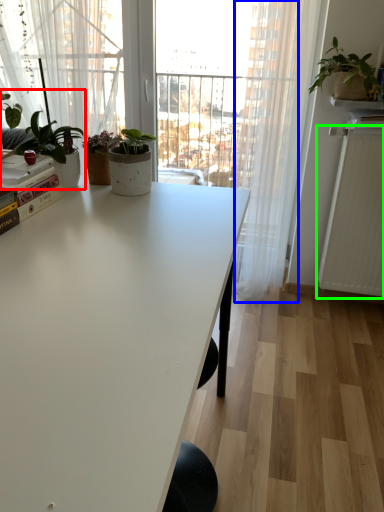
Question: Which is farther away from houseplant (highlighted by a red box)? curtain (highlighted by a blue box) or radiator (highlighted by a green box)?

Choices:
 (A) curtain
 (B) radiator

Answer: (B)